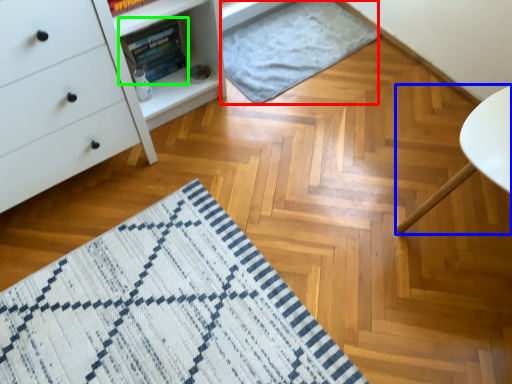
Question: Which object is positioned closest to blanket (highlighted by a red box)? Select from furniture (highlighted by a blue box) and book (highlighted by a green box).

Choices:
 (A) furniture
 (B) book

Answer: (B)